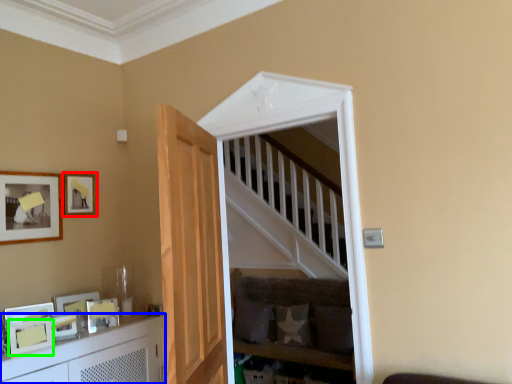
Question: Based on their relative distances, which object is farther from picture frame (highlighted by a red box)? Choose from cabinetry (highlighted by a blue box) and picture frame (highlighted by a green box).

Choices:
 (A) cabinetry
 (B) picture frame

Answer: (A)